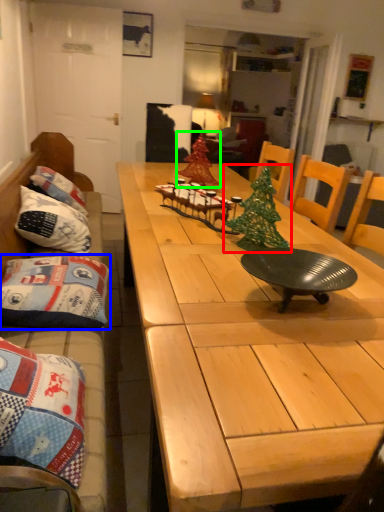
Question: Estimate the real-world distances between objects in this image. Which object is closer to christmas tree (highlighted by a red box), pillow (highlighted by a blue box) or christmas tree (highlighted by a green box)?

Choices:
 (A) pillow
 (B) christmas tree

Answer: (A)